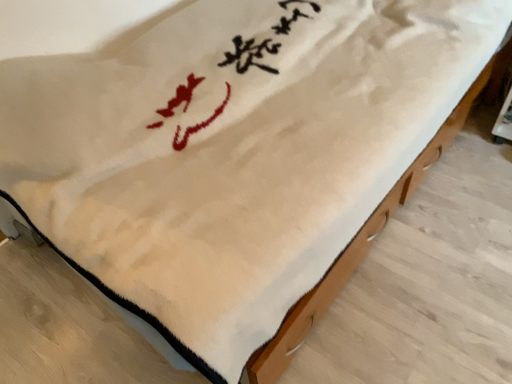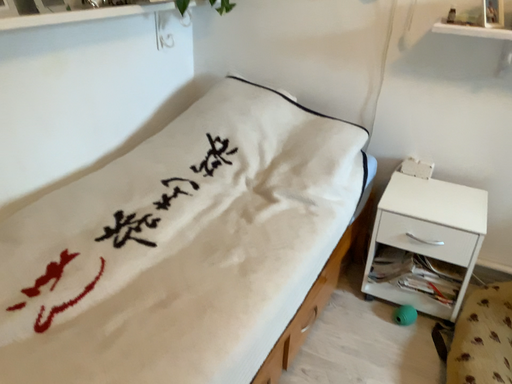
Question: How did the camera likely rotate when shooting the video?

Choices:
 (A) rotated upward
 (B) rotated downward

Answer: (A)